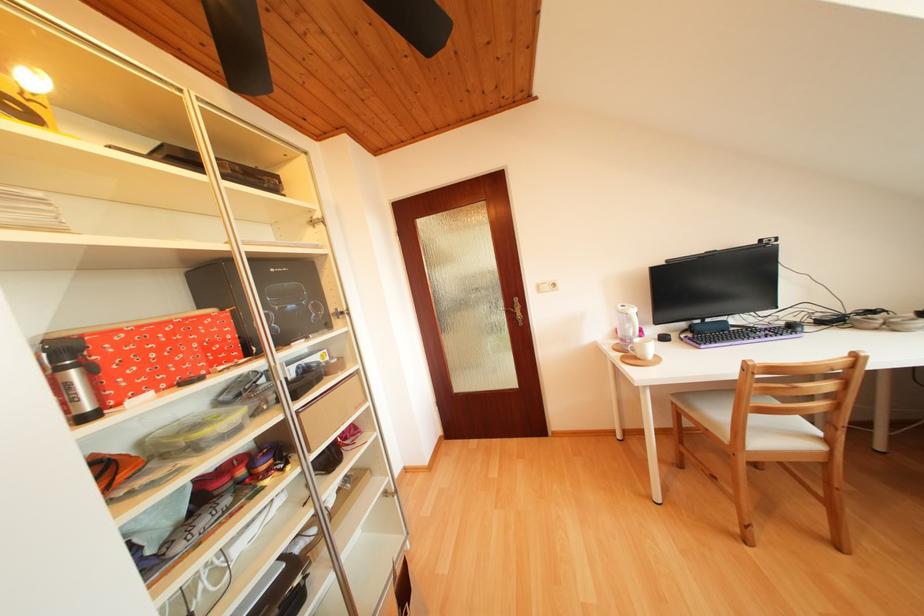
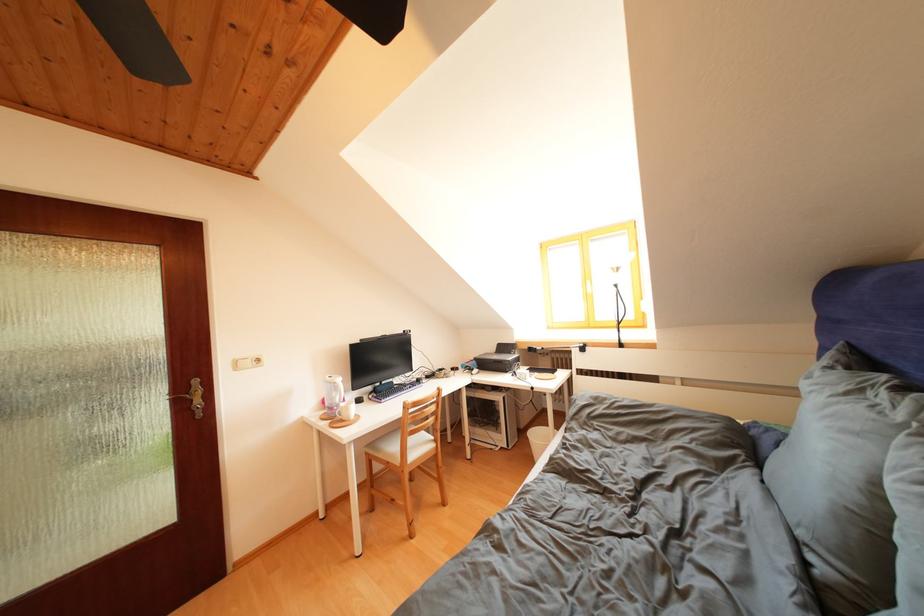
Locate, in the second image, the point that corresponds to the point at 545,293 in the first image.

(244, 369)